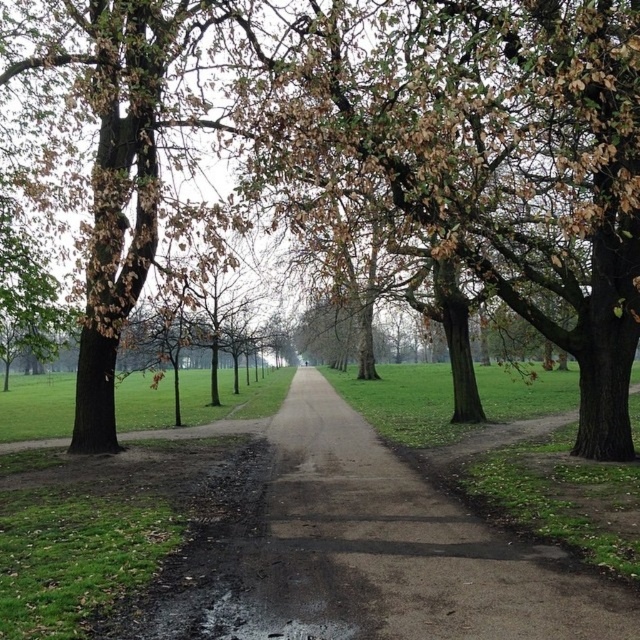
Which is behind, point (548, 248) or point (512, 570)?

Positioned behind is point (548, 248).

Does green leafy tree at center have a lesser width compared to dull brown dirt path at center?

Indeed, green leafy tree at center has a lesser width compared to dull brown dirt path at center.

In order to click on green leafy tree at center in this screenshot , I will do `click(486, 154)`.

In order to click on green leafy tree at center in this screenshot , I will do `click(486, 154)`.